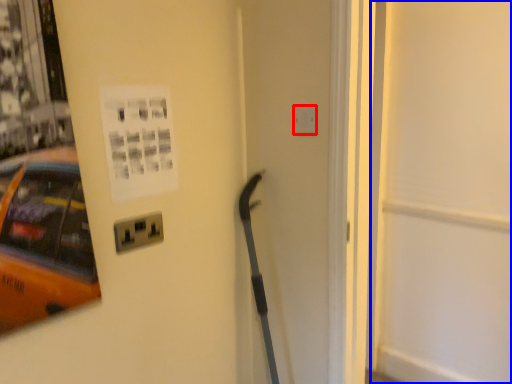
Question: Which object appears farthest to the camera in this image, electric outlet (highlighted by a red box) or door (highlighted by a blue box)?

Choices:
 (A) electric outlet
 (B) door

Answer: (A)